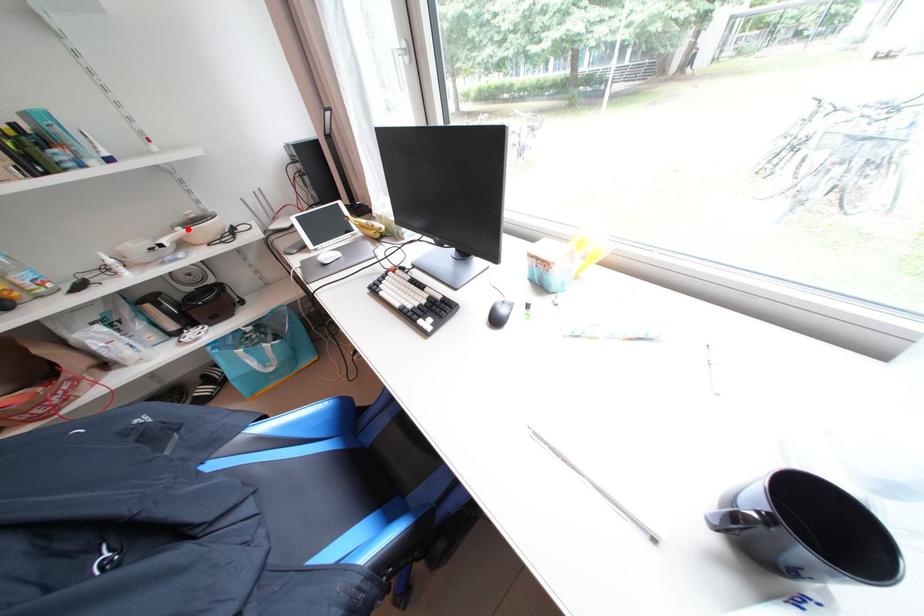
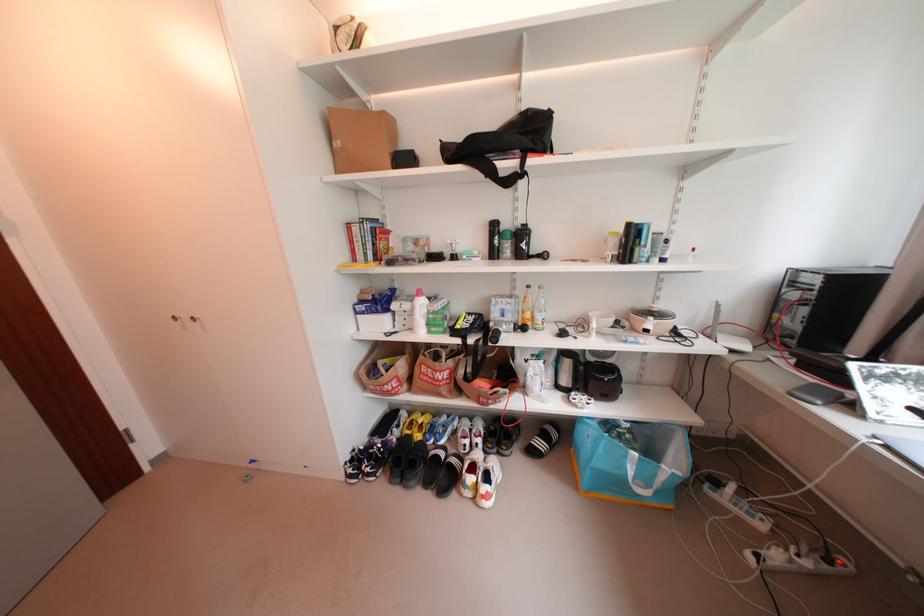
Find the pixel in the second image that matches the highlighted location in the first image.

(660, 320)